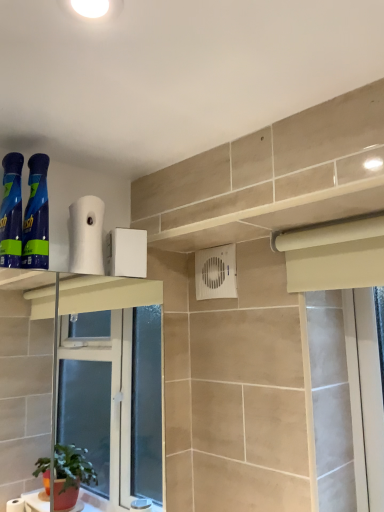
Question: Does blue glossy spray can at left, which ranks as the 2th cleaning product in right-to-left order, have a greater height compared to white matte toilet paper at upper center?

Choices:
 (A) yes
 (B) no

Answer: (A)

Question: Does blue glossy spray can at left, placed as the first cleaning product when sorted from left to right, contain white matte toilet paper at upper center?

Choices:
 (A) no
 (B) yes

Answer: (A)

Question: Can you confirm if blue glossy spray can at left, which ranks as the 2th cleaning product in right-to-left order, is wider than white matte toilet paper at upper center?

Choices:
 (A) no
 (B) yes

Answer: (B)

Question: From the image's perspective, does blue glossy spray can at left, placed as the first cleaning product when sorted from left to right, appear lower than white matte toilet paper at upper center?

Choices:
 (A) yes
 (B) no

Answer: (B)

Question: From the image's perspective, is blue glossy spray can at left, which ranks as the 2th cleaning product in right-to-left order, located above white matte toilet paper at upper center?

Choices:
 (A) yes
 (B) no

Answer: (A)

Question: Is blue glossy spray can at left, which ranks as the 2th cleaning product in right-to-left order, to the right of white matte toilet paper at upper center from the viewer's perspective?

Choices:
 (A) yes
 (B) no

Answer: (B)

Question: Is white matte toilet paper at upper center taller than blue glossy spray bottles at left, acting as the second cleaning product starting from the left?

Choices:
 (A) yes
 (B) no

Answer: (B)

Question: Is white matte toilet paper at upper center to the right of blue glossy spray bottles at left, which ranks as the first cleaning product in right-to-left order, from the viewer's perspective?

Choices:
 (A) no
 (B) yes

Answer: (B)

Question: From a real-world perspective, does white matte toilet paper at upper center sit lower than blue glossy spray bottles at left, acting as the second cleaning product starting from the left?

Choices:
 (A) no
 (B) yes

Answer: (B)

Question: Considering the relative sizes of white matte toilet paper at upper center and blue glossy spray bottles at left, which ranks as the first cleaning product in right-to-left order, in the image provided, is white matte toilet paper at upper center shorter than blue glossy spray bottles at left, which ranks as the first cleaning product in right-to-left order,?

Choices:
 (A) no
 (B) yes

Answer: (B)

Question: Can you confirm if white matte toilet paper at upper center is smaller than blue glossy spray bottles at left, acting as the second cleaning product starting from the left?

Choices:
 (A) yes
 (B) no

Answer: (B)

Question: Can you confirm if white matte toilet paper at upper center is positioned to the left of blue glossy spray bottles at left, which ranks as the first cleaning product in right-to-left order?

Choices:
 (A) no
 (B) yes

Answer: (A)

Question: Is blue glossy spray can at left, which ranks as the 2th cleaning product in right-to-left order, at the back of white plastic air conditioning unit at center?

Choices:
 (A) yes
 (B) no

Answer: (B)